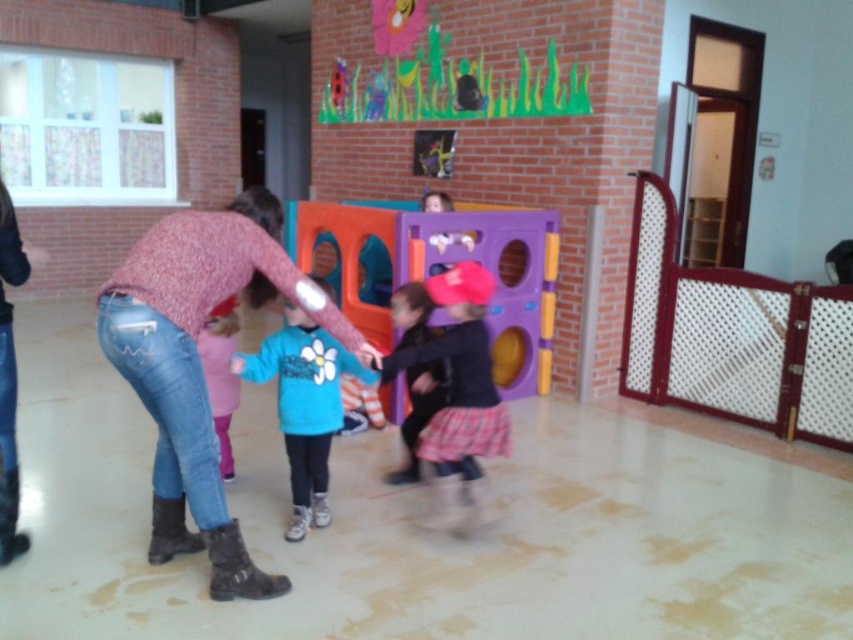
Between pink matte cap at center and pink fabric pants at lower left, which one is positioned lower?

pink matte cap at center is lower down.

In the scene shown: Which is more to the right, pink matte cap at center or pink fabric pants at lower left?

From the viewer's perspective, pink matte cap at center appears more on the right side.

Who is more forward, [476,500] or [213,364]?

Point [476,500] is in front.

Find the location of `pink matte cap at center`. pink matte cap at center is located at coordinates (457, 400).

In the scene shown: Who is more distant from viewer, (187, 252) or (347, 365)?

Positioned behind is point (347, 365).

Who is taller, jeans at center or blue fleece jacket at center?

With more height is jeans at center.

Which is behind, point (195, 269) or point (291, 344)?

Positioned behind is point (291, 344).

Where is `jeans at center`? This screenshot has height=640, width=853. jeans at center is located at coordinates (199, 364).

You are a GUI agent. You are given a task and a screenshot of the screen. Output one action in this format:
    pyautogui.click(x=<x>, y=<y>)
    Task: Click on the jeans at center
    Image resolution: width=853 pixels, height=640 pixels.
    Given the screenshot: What is the action you would take?
    pyautogui.click(x=199, y=364)

Is the position of jeans at center less distant than that of pink fabric pants at lower left?

Yes, jeans at center is closer to the viewer.

Which is behind, point (281, 212) or point (215, 360)?

The point (215, 360) is behind.

In order to click on jeans at center in this screenshot , I will do `click(199, 364)`.